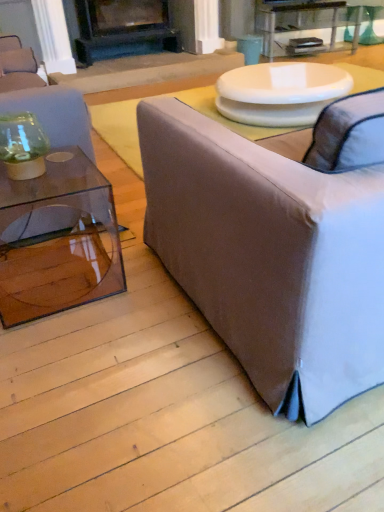
This screenshot has width=384, height=512. What do you see at coordinates (300, 27) in the screenshot?
I see `clear glass table at upper center` at bounding box center [300, 27].

Describe the element at coordinates (280, 93) in the screenshot. I see `white glossy table at upper center` at that location.

This screenshot has width=384, height=512. Find the location of `transparent glass vase at left, which ranks as the 2th studio couch in right-to-left order`. transparent glass vase at left, which ranks as the 2th studio couch in right-to-left order is located at coordinates (55, 114).

Based on the photo, is transparent glass vase at left, which ranks as the 2th studio couch in right-to-left order, at the right side of light gray fabric couch at right, acting as the 1th studio couch starting from the right?

In fact, transparent glass vase at left, which ranks as the 2th studio couch in right-to-left order, is to the left of light gray fabric couch at right, acting as the 1th studio couch starting from the right.

Does transparent glass vase at left, positioned as the 1th studio couch in left-to-right order, contain light gray fabric couch at right, the second studio couch in the left-to-right sequence?

No, transparent glass vase at left, positioned as the 1th studio couch in left-to-right order, does not contain light gray fabric couch at right, the second studio couch in the left-to-right sequence.

Considering the relative sizes of transparent glass vase at left, positioned as the 1th studio couch in left-to-right order, and light gray fabric couch at right, the second studio couch in the left-to-right sequence, in the image provided, is transparent glass vase at left, positioned as the 1th studio couch in left-to-right order, thinner than light gray fabric couch at right, the second studio couch in the left-to-right sequence,?

Correct, the width of transparent glass vase at left, positioned as the 1th studio couch in left-to-right order, is less than that of light gray fabric couch at right, the second studio couch in the left-to-right sequence.

Does point (311, 41) come behind point (321, 92)?

Yes, point (311, 41) is behind point (321, 92).

From a real-world perspective, between clear glass table at upper center and white glossy table at upper center, who is vertically lower?

white glossy table at upper center.

Do you think clear glass table at upper center is within white glossy table at upper center, or outside of it?

clear glass table at upper center is spatially situated outside white glossy table at upper center.

Considering the relative sizes of clear glass table at upper center and white glossy table at upper center in the image provided, is clear glass table at upper center smaller than white glossy table at upper center?

Yes, clear glass table at upper center is smaller than white glossy table at upper center.

Looking at this image, which is more to the right, transparent glass vase at left, which ranks as the 2th studio couch in right-to-left order, or white glossy table at upper center?

white glossy table at upper center.

Can you confirm if transparent glass vase at left, which ranks as the 2th studio couch in right-to-left order, is thinner than white glossy table at upper center?

Yes.

In terms of height, does transparent glass vase at left, which ranks as the 2th studio couch in right-to-left order, look taller or shorter compared to white glossy table at upper center?

Considering their sizes, transparent glass vase at left, which ranks as the 2th studio couch in right-to-left order, has more height than white glossy table at upper center.

From a real-world perspective, who is located higher, transparent glass vase at left, positioned as the 1th studio couch in left-to-right order, or white glossy table at upper center?

transparent glass vase at left, positioned as the 1th studio couch in left-to-right order, is physically above.

Could you tell me if light gray fabric couch at right, acting as the 1th studio couch starting from the right, is facing black matte fireplace at upper center?

Yes, light gray fabric couch at right, acting as the 1th studio couch starting from the right, is turned towards black matte fireplace at upper center.

Where is `the 2nd studio couch counting from the right side of the black matte fireplace at upper center`? The height and width of the screenshot is (512, 384). the 2nd studio couch counting from the right side of the black matte fireplace at upper center is located at coordinates (270, 256).

Can black matte fireplace at upper center be found inside light gray fabric couch at right, the second studio couch in the left-to-right sequence?

No, black matte fireplace at upper center is located outside of light gray fabric couch at right, the second studio couch in the left-to-right sequence.

Which object is positioned more to the right, light gray fabric couch at right, the second studio couch in the left-to-right sequence, or black matte fireplace at upper center?

light gray fabric couch at right, the second studio couch in the left-to-right sequence.

Relative to transparent glass coffee table at left, is transparent glass vase at left, which ranks as the 2th studio couch in right-to-left order, in front or behind?

Visually, transparent glass vase at left, which ranks as the 2th studio couch in right-to-left order, is located behind transparent glass coffee table at left.

Is transparent glass vase at left, which ranks as the 2th studio couch in right-to-left order, far from transparent glass coffee table at left?

transparent glass vase at left, which ranks as the 2th studio couch in right-to-left order, is actually quite close to transparent glass coffee table at left.

From the image's perspective, is transparent glass vase at left, which ranks as the 2th studio couch in right-to-left order, under transparent glass coffee table at left?

No.

Does transparent glass vase at left, which ranks as the 2th studio couch in right-to-left order, have a larger size compared to transparent glass coffee table at left?

No, transparent glass vase at left, which ranks as the 2th studio couch in right-to-left order, is not bigger than transparent glass coffee table at left.

Is transparent glass coffee table at left beside light gray fabric couch at right, acting as the 1th studio couch starting from the right?

No, transparent glass coffee table at left is not next to light gray fabric couch at right, acting as the 1th studio couch starting from the right.

Which point is more forward, (x=31, y=182) or (x=314, y=250)?

Point (x=314, y=250)

From a real-world perspective, is transparent glass coffee table at left positioned over light gray fabric couch at right, the second studio couch in the left-to-right sequence, based on gravity?

Actually, transparent glass coffee table at left is physically below light gray fabric couch at right, the second studio couch in the left-to-right sequence, in the real world.

Between transparent glass coffee table at left and light gray fabric couch at right, acting as the 1th studio couch starting from the right, which one appears on the right side from the viewer's perspective?

Positioned to the right is light gray fabric couch at right, acting as the 1th studio couch starting from the right.

You are a GUI agent. You are given a task and a screenshot of the screen. Output one action in this format:
    pyautogui.click(x=<x>, y=<y>)
    Task: Click on the round table below the clear glass table at upper center (from the image's perspective)
    This screenshot has width=384, height=512.
    Given the screenshot: What is the action you would take?
    pyautogui.click(x=280, y=93)

In terms of width, does white glossy table at upper center look wider or thinner when compared to clear glass table at upper center?

white glossy table at upper center is wider than clear glass table at upper center.

Is white glossy table at upper center next to clear glass table at upper center and touching it?

white glossy table at upper center and clear glass table at upper center are not in contact.

I want to click on studio couch above the light gray fabric couch at right, the second studio couch in the left-to-right sequence (from a real-world perspective), so click(55, 114).

Locate an element on the screen. round table in front of the clear glass table at upper center is located at coordinates (280, 93).

Which object lies nearer to the anchor point transparent glass coffee table at left, black matte fireplace at upper center or light gray fabric couch at right, the second studio couch in the left-to-right sequence?

light gray fabric couch at right, the second studio couch in the left-to-right sequence.

Based on their spatial positions, is clear glass table at upper center or light gray fabric couch at right, acting as the 1th studio couch starting from the right, closer to white glossy table at upper center?

The object closer to white glossy table at upper center is light gray fabric couch at right, acting as the 1th studio couch starting from the right.

In the scene shown: Looking at the image, which one is located further to white glossy table at upper center, black matte fireplace at upper center or clear glass table at upper center?

black matte fireplace at upper center is positioned further to the anchor white glossy table at upper center.

Estimate the real-world distances between objects in this image. Which object is further from transparent glass vase at left, which ranks as the 2th studio couch in right-to-left order, black matte fireplace at upper center or transparent glass coffee table at left?

The object further to transparent glass vase at left, which ranks as the 2th studio couch in right-to-left order, is black matte fireplace at upper center.

Which object lies further to the anchor point clear glass table at upper center, transparent glass vase at left, which ranks as the 2th studio couch in right-to-left order, or transparent glass coffee table at left?

Based on the image, transparent glass coffee table at left appears to be further to clear glass table at upper center.

From the image, which object appears to be farther from light gray fabric couch at right, acting as the 1th studio couch starting from the right, black matte fireplace at upper center or transparent glass coffee table at left?

black matte fireplace at upper center is further to light gray fabric couch at right, acting as the 1th studio couch starting from the right.

Based on their spatial positions, is clear glass table at upper center or transparent glass vase at left, which ranks as the 2th studio couch in right-to-left order, further from transparent glass coffee table at left?

clear glass table at upper center is positioned further to the anchor transparent glass coffee table at left.

Which object lies further to the anchor point transparent glass vase at left, which ranks as the 2th studio couch in right-to-left order, transparent glass coffee table at left or light gray fabric couch at right, acting as the 1th studio couch starting from the right?

light gray fabric couch at right, acting as the 1th studio couch starting from the right, is positioned further to the anchor transparent glass vase at left, which ranks as the 2th studio couch in right-to-left order.

The image size is (384, 512). In order to click on round table located between light gray fabric couch at right, the second studio couch in the left-to-right sequence, and black matte fireplace at upper center in the depth direction in this screenshot , I will do 280,93.

What are the coordinates of `coffee table between light gray fabric couch at right, the second studio couch in the left-to-right sequence, and clear glass table at upper center in the front-back direction` in the screenshot? It's located at (57, 239).

This screenshot has height=512, width=384. Identify the location of round table between light gray fabric couch at right, acting as the 1th studio couch starting from the right, and clear glass table at upper center, along the z-axis. (280, 93).

This screenshot has height=512, width=384. Identify the location of studio couch between transparent glass coffee table at left and black matte fireplace at upper center from front to back. (55, 114).